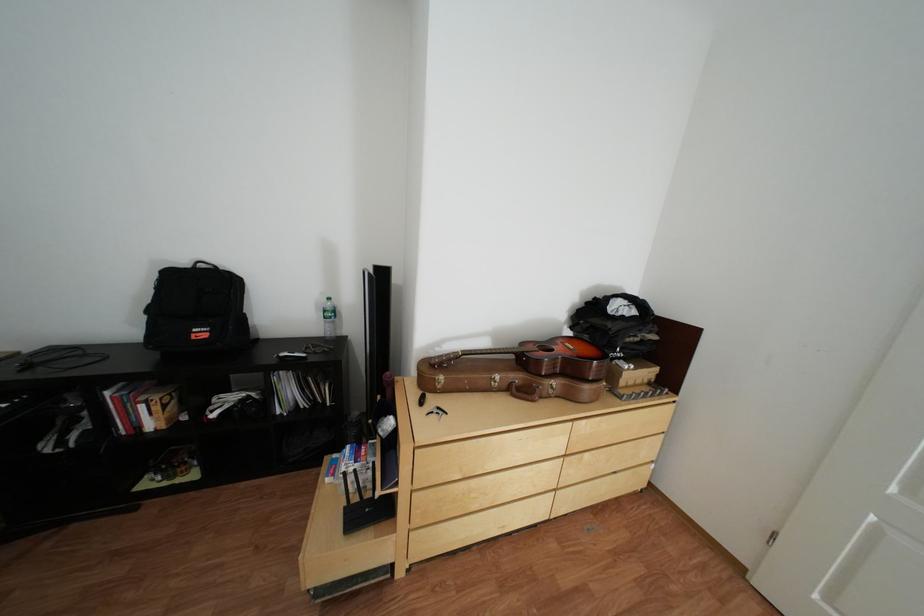
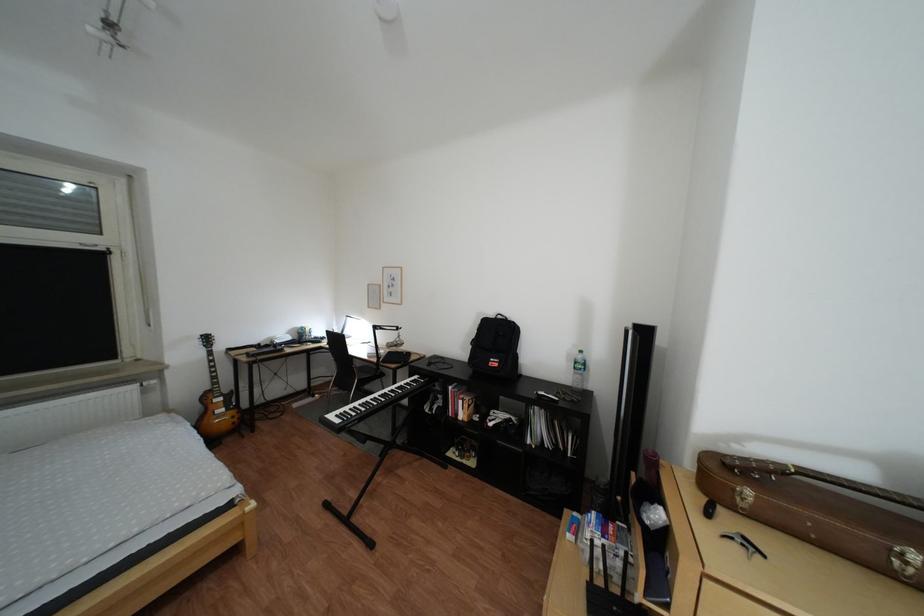
The point at (216, 334) is marked in the first image. Where is the corresponding point in the second image?

(509, 363)